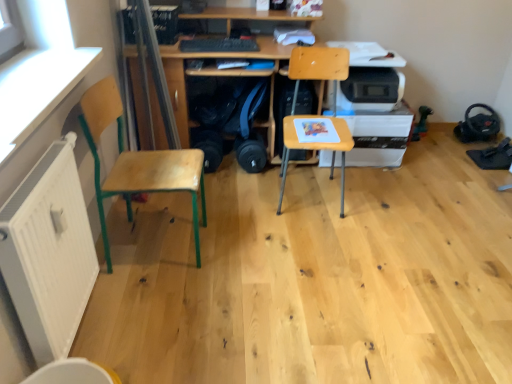
The image size is (512, 384). Find the location of `space that is in front of wooden at left, positioned as the 2th chair in right-to-left order`. space that is in front of wooden at left, positioned as the 2th chair in right-to-left order is located at coordinates (160, 305).